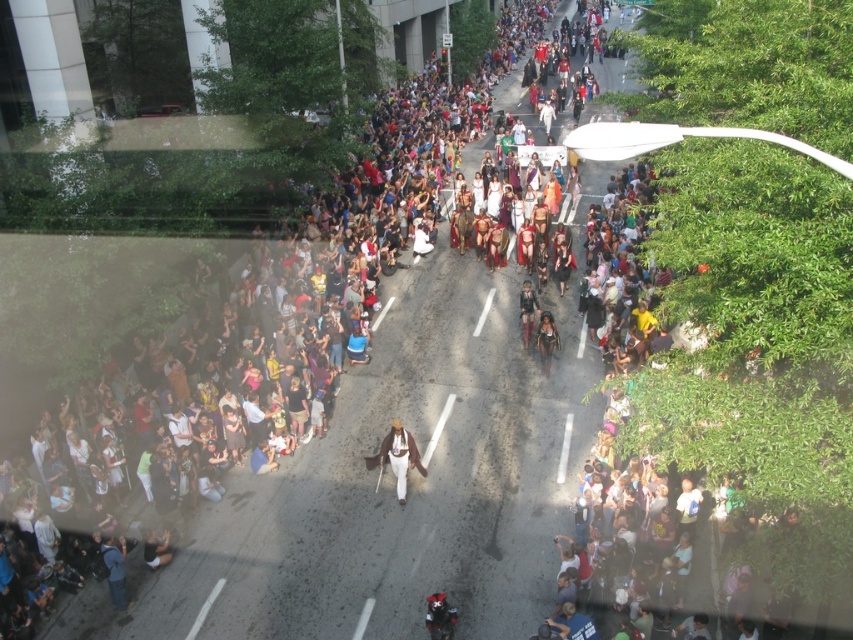
You are standing at the elevated viewpoint watching the parade. There are two points marked in the scene. The first point is at coordinates point (442,618) and the second is at point (550,337). Which point is closer to you?

Point (442,618) is in front of point (550,337), so the first point is closer to you.

You are a photographer standing at the edge of the crowd in the street parade scene. You want to take a photo of both the white fur coat at center and the black leather motorcycle at center. Which object should you focus on first to ensure it appears larger in your photo?

The white fur coat at center is much taller than the black leather motorcycle at center, so you should focus on the white fur coat at center first to ensure it appears larger in your photo.

Consider the image. You are standing at the elevated window and want to take a photo of the parade. There are two points of interest in the scene marked as point 1 at coordinates point (389, 464) and point 2 at coordinates point (548, 320). Which point is closer to you, point 1 or point 2?

Point 1 at coordinates point (389, 464) is closer to you because it is in front of point 2 at coordinates point (548, 320).